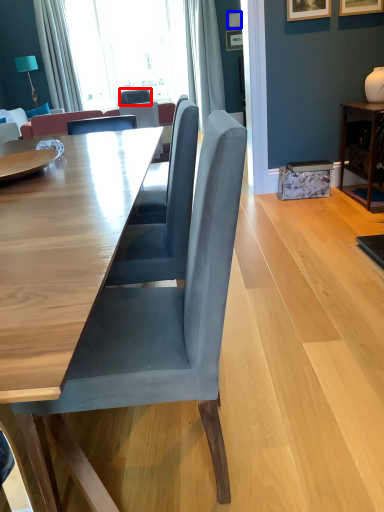
Question: Which object appears farthest to the camera in this image, chair (highlighted by a red box) or picture frame (highlighted by a blue box)?

Choices:
 (A) chair
 (B) picture frame

Answer: (A)